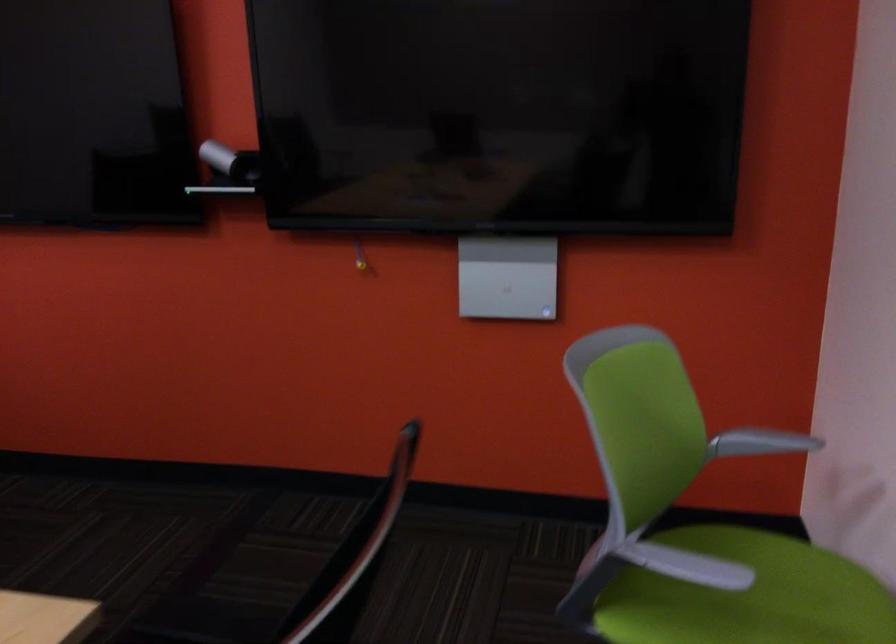
Identify the location of green chair sitting surface. This screenshot has width=896, height=644. (747, 596).